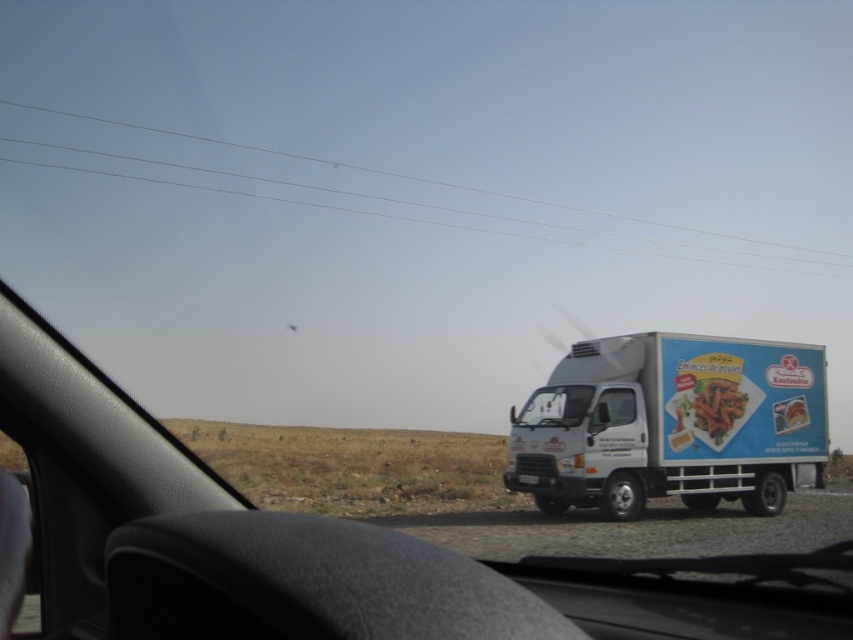
Question: Which point is farther from the camera taking this photo?

Choices:
 (A) (573, 406)
 (B) (814, 346)

Answer: (B)

Question: Is smooth plastic carrots at center wider than transparent glass windshield at center?

Choices:
 (A) yes
 (B) no

Answer: (A)

Question: Which object appears closest to the camera in this image?

Choices:
 (A) smooth plastic food at center
 (B) white matte trailer truck at right
 (C) clear wire at upper center

Answer: (B)

Question: From the image, what is the correct spatial relationship of clear wire at upper center in relation to transparent glass windshield at center?

Choices:
 (A) above
 (B) below

Answer: (A)

Question: Where is white matte trailer truck at right located in relation to transparent glass windshield at center in the image?

Choices:
 (A) below
 (B) above

Answer: (A)

Question: Among these points, which one is nearest to the camera?

Choices:
 (A) (556, 401)
 (B) (701, 394)

Answer: (A)